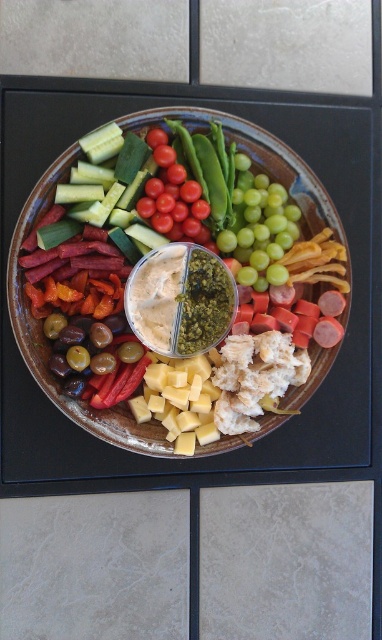
You are a food stylist arranging this platter. You need to place a garnish between the yellow cube cheese at center and the red glossy cherry tomatoes at center. Which object should the garnish be closer to, based on their positions?

The garnish should be placed closer to the red glossy cherry tomatoes at center because the yellow cube cheese at center is closer to the viewer, meaning the cherry tomatoes are behind it and thus farther away. Placing the garnish between them would require it to be closer to the tomatoes to maintain proper spatial arrangement.

You are arranging a snack platter and want to place the brown ceramic platter at center and the smooth creamy dip at center in a specific layout. According to the image, which object is positioned to the right of the other?

The brown ceramic platter at center is to the right of the smooth creamy dip at center.

What are the coordinates of the brown ceramic platter at center?

The brown ceramic platter at center is located at coordinates point (x=48, y=346).